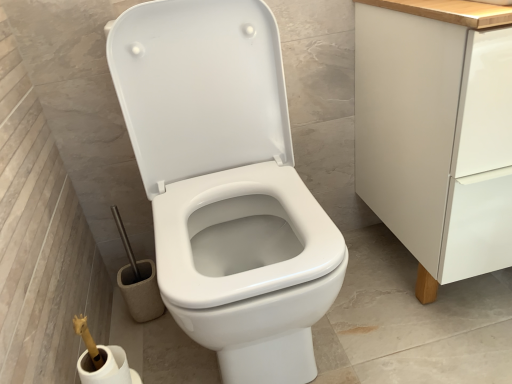
Question: Is white matte cabinet at right in front of or behind white matte toilet paper at lower left in the image?

Choices:
 (A) behind
 (B) front

Answer: (B)

Question: Does point (484, 107) appear closer or farther from the camera than point (121, 352)?

Choices:
 (A) farther
 (B) closer

Answer: (B)

Question: Which object is positioned farthest from the white matte toilet paper at lower left?

Choices:
 (A) white glossy toilet at center
 (B) white matte cabinet at right

Answer: (B)

Question: Considering the real-world distances, which object is closest to the white glossy toilet at center?

Choices:
 (A) white matte toilet paper at lower left
 (B) white matte cabinet at right

Answer: (B)